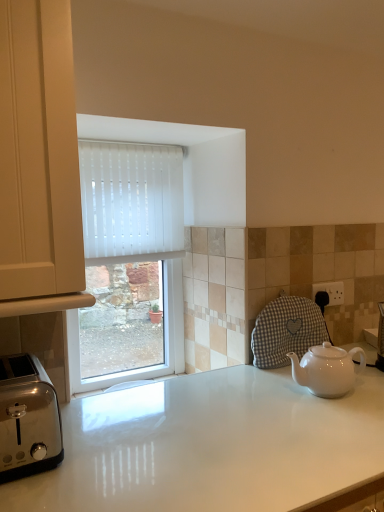
Question: Is white glossy countertop at center oriented away from polished stainless steel toaster at lower left?

Choices:
 (A) yes
 (B) no

Answer: (B)

Question: Does white glossy countertop at center come in front of polished stainless steel toaster at lower left?

Choices:
 (A) no
 (B) yes

Answer: (B)

Question: Are white glossy countertop at center and polished stainless steel toaster at lower left beside each other?

Choices:
 (A) yes
 (B) no

Answer: (B)

Question: Does white glossy countertop at center come behind polished stainless steel toaster at lower left?

Choices:
 (A) no
 (B) yes

Answer: (A)

Question: Is white glossy countertop at center not inside polished stainless steel toaster at lower left?

Choices:
 (A) no
 (B) yes

Answer: (B)

Question: Considering the relative sizes of white glossy countertop at center and polished stainless steel toaster at lower left in the image provided, is white glossy countertop at center smaller than polished stainless steel toaster at lower left?

Choices:
 (A) no
 (B) yes

Answer: (A)

Question: Would you say white ceramic teapot at lower right is a long distance from polished stainless steel toaster at lower left?

Choices:
 (A) yes
 (B) no

Answer: (B)

Question: From the image's perspective, is white ceramic teapot at lower right located beneath polished stainless steel toaster at lower left?

Choices:
 (A) no
 (B) yes

Answer: (A)

Question: Is white ceramic teapot at lower right positioned with its back to polished stainless steel toaster at lower left?

Choices:
 (A) no
 (B) yes

Answer: (A)

Question: Could polished stainless steel toaster at lower left be considered to be inside white ceramic teapot at lower right?

Choices:
 (A) no
 (B) yes

Answer: (A)

Question: Considering the relative sizes of white ceramic teapot at lower right and polished stainless steel toaster at lower left in the image provided, is white ceramic teapot at lower right smaller than polished stainless steel toaster at lower left?

Choices:
 (A) yes
 (B) no

Answer: (A)

Question: Does white ceramic teapot at lower right have a lesser height compared to polished stainless steel toaster at lower left?

Choices:
 (A) yes
 (B) no

Answer: (A)

Question: From the image's perspective, is white glossy countertop at center on white ceramic teapot at lower right?

Choices:
 (A) no
 (B) yes

Answer: (A)